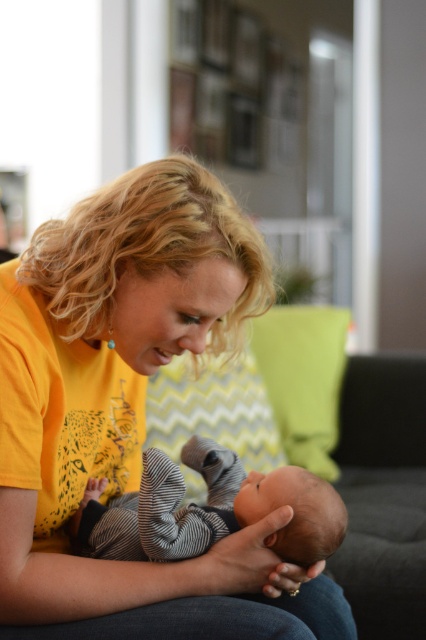
Consider the image. You are a photographer setting up a shoot. You need to ensure that the yellow matte shirt at center and the striped cotton onesie at center are both visible in the frame. Based on their positions, which one is closer to the camera?

The yellow matte shirt at center is located above the striped cotton onesie at center, which suggests it is closer to the camera since objects higher in the frame are typically nearer in such compositions.

You are a photographer setting up for a family photo. The woman is holding the baby, and there is a yellow zigzag fabric pillow at center. Where should you position the main light to ensure the pillow is well lit without casting harsh shadows on the baby?

The yellow zigzag fabric pillow at center is located at point (213, 412), so positioning the main light slightly to the side of the pillow would provide even lighting while avoiding harsh shadows on the baby.

You are a photographer adjusting your camera to focus on two points in the image. The first point is point (129, 349) and the second is point (324, 525). Which point should you focus on first if you want to capture the closest object to the camera?

You should focus on point (129, 349) first because it is closer to the camera than point (324, 525).